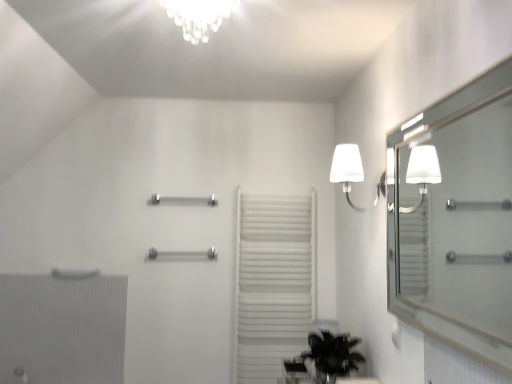
Question: Can you confirm if polished chrome towel bar at center, arranged as the 1th towel bar when ordered from the bottom, is smaller than white matte towel rack at center?

Choices:
 (A) yes
 (B) no

Answer: (A)

Question: Is polished chrome towel bar at center, acting as the second towel bar starting from the top, next to white matte towel rack at center?

Choices:
 (A) no
 (B) yes

Answer: (A)

Question: Could you tell me if polished chrome towel bar at center, acting as the second towel bar starting from the top, is turned towards white matte towel rack at center?

Choices:
 (A) yes
 (B) no

Answer: (B)

Question: From the image's perspective, is polished chrome towel bar at center, arranged as the 1th towel bar when ordered from the bottom, beneath white matte towel rack at center?

Choices:
 (A) no
 (B) yes

Answer: (A)

Question: Is polished chrome towel bar at center, acting as the second towel bar starting from the top, looking in the opposite direction of white matte towel rack at center?

Choices:
 (A) yes
 (B) no

Answer: (B)

Question: Considering the relative sizes of polished chrome towel bar at center, arranged as the 1th towel bar when ordered from the bottom, and white matte towel rack at center in the image provided, is polished chrome towel bar at center, arranged as the 1th towel bar when ordered from the bottom, thinner than white matte towel rack at center?

Choices:
 (A) no
 (B) yes

Answer: (B)

Question: Considering the relative sizes of green leafy plant at lower center and white textured radiator at lower left in the image provided, is green leafy plant at lower center shorter than white textured radiator at lower left?

Choices:
 (A) yes
 (B) no

Answer: (A)

Question: From the image's perspective, is green leafy plant at lower center under white textured radiator at lower left?

Choices:
 (A) yes
 (B) no

Answer: (B)

Question: From a real-world perspective, is green leafy plant at lower center under white textured radiator at lower left?

Choices:
 (A) yes
 (B) no

Answer: (A)

Question: Is the depth of green leafy plant at lower center less than that of white textured radiator at lower left?

Choices:
 (A) no
 (B) yes

Answer: (B)

Question: Is green leafy plant at lower center looking in the opposite direction of white textured radiator at lower left?

Choices:
 (A) yes
 (B) no

Answer: (B)

Question: Are green leafy plant at lower center and white textured radiator at lower left located far from each other?

Choices:
 (A) yes
 (B) no

Answer: (A)

Question: Would you consider white fabric lamp at upper right to be distant from polished chrome towel bar at center, positioned as the 2th towel bar in bottom-to-top order?

Choices:
 (A) yes
 (B) no

Answer: (A)